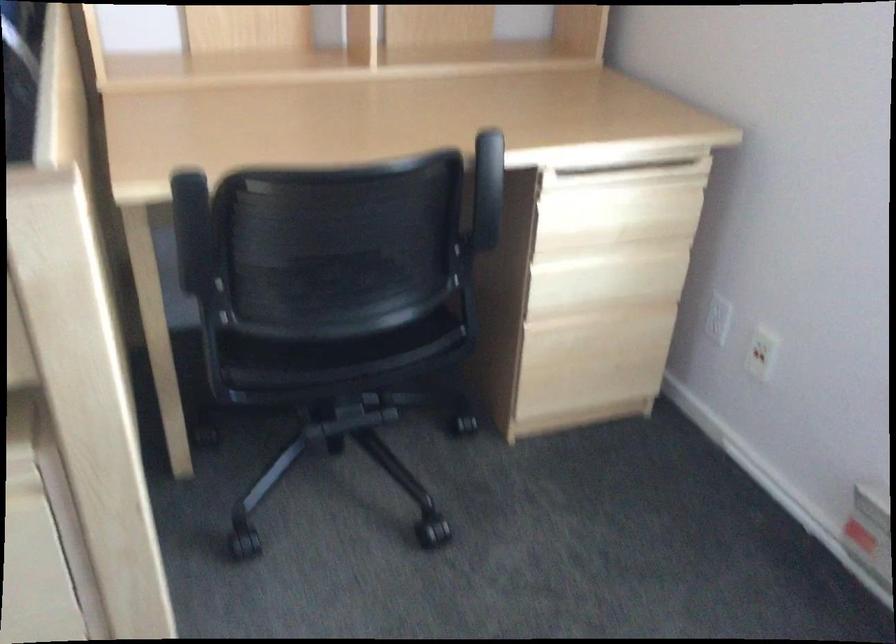
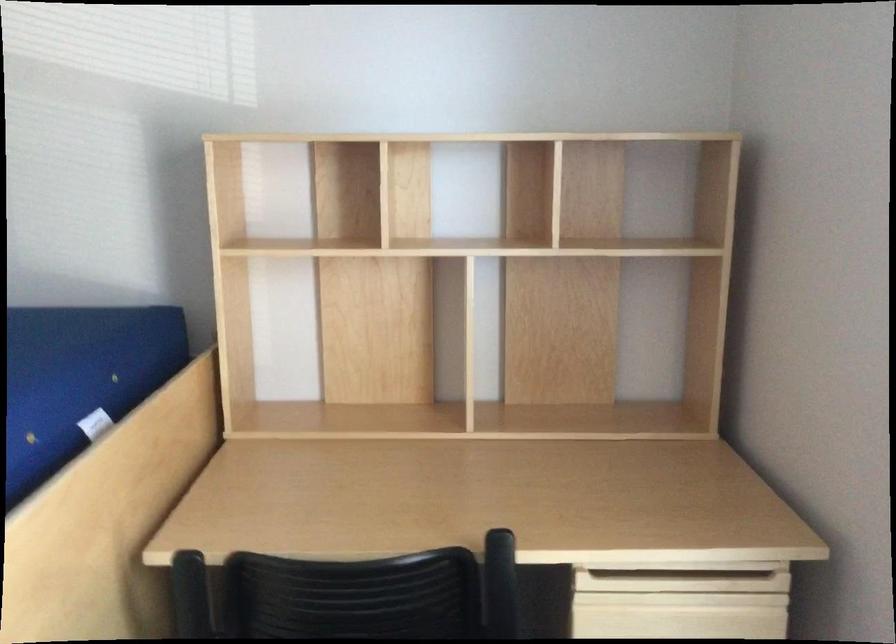
Question: What movement of the cameraman would produce the second image?

Choices:
 (A) Left
 (B) Right
 (C) Forward
 (D) Backward

Answer: (B)